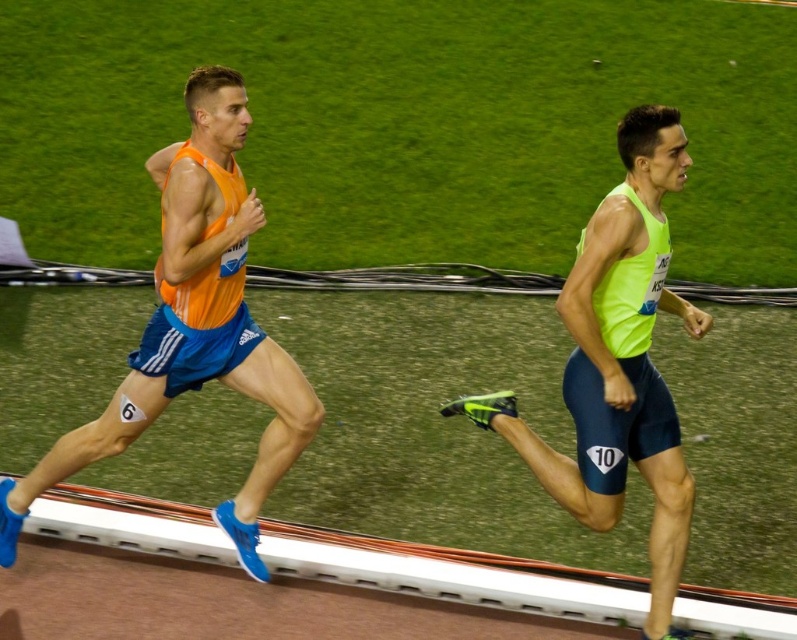
Question: From the image, what is the correct spatial relationship of matte orange tank top at left in relation to neon green fabric shorts at right?

Choices:
 (A) below
 (B) above

Answer: (B)

Question: Which point appears farthest from the camera in this image?

Choices:
 (A) (226, 529)
 (B) (564, 490)

Answer: (A)

Question: Which point appears closest to the camera in this image?

Choices:
 (A) (603, 486)
 (B) (202, 241)

Answer: (A)

Question: Can you confirm if matte orange tank top at left is positioned to the right of neon green fabric shorts at right?

Choices:
 (A) yes
 (B) no

Answer: (B)

Question: Does matte orange tank top at left have a lesser width compared to neon green fabric shorts at right?

Choices:
 (A) yes
 (B) no

Answer: (B)

Question: Which point appears closest to the camera in this image?

Choices:
 (A) (635, 237)
 (B) (232, 77)

Answer: (A)